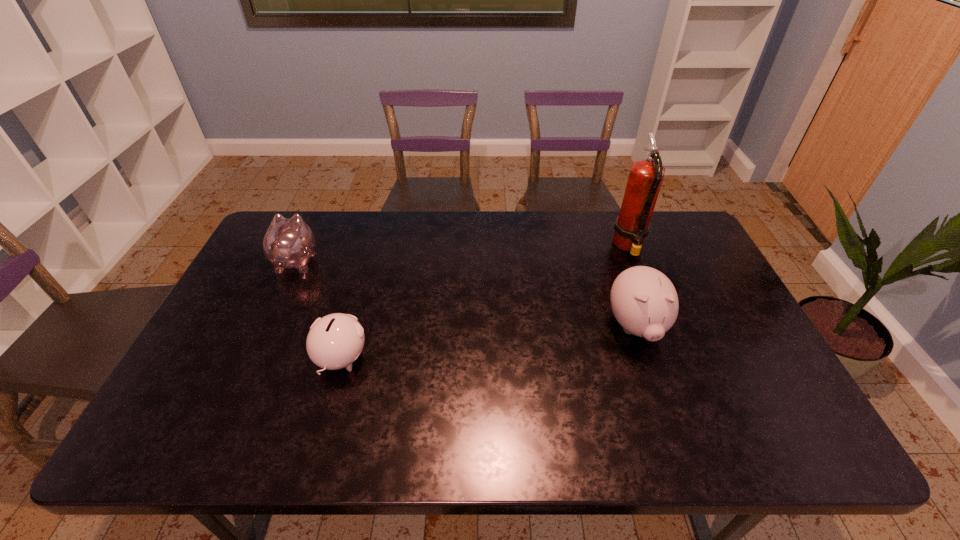
Locate an element on the screen. This screenshot has height=540, width=960. the tallest object is located at coordinates (632, 225).

You are a GUI agent. You are given a task and a screenshot of the screen. Output one action in this format:
    pyautogui.click(x=<x>, y=<y>)
    Task: Click on the rightmost piggy bank
    The height and width of the screenshot is (540, 960).
    Given the screenshot: What is the action you would take?
    pyautogui.click(x=644, y=301)

The width and height of the screenshot is (960, 540). Identify the location of the farthest piggy bank. (288, 243).

I want to click on the leftmost piggy bank, so click(x=288, y=243).

The image size is (960, 540). What are the coordinates of `the second piggy bank from right to left` in the screenshot? It's located at (335, 341).

What are the coordinates of `the shortest object` in the screenshot? It's located at (335, 341).

In order to click on free space located 0.270m at the nozzle of the fire extinguisher in this screenshot , I will do `click(530, 246)`.

This screenshot has width=960, height=540. What are the coordinates of `vacant space located 0.270m at the nozzle of the fire extinguisher` in the screenshot? It's located at (530, 246).

The image size is (960, 540). Find the location of `free space located at the nozzle of the fire extinguisher`. free space located at the nozzle of the fire extinguisher is located at coordinates (563, 246).

This screenshot has height=540, width=960. Find the location of `free space located at the snout of the rightmost piggy bank`. free space located at the snout of the rightmost piggy bank is located at coordinates (654, 379).